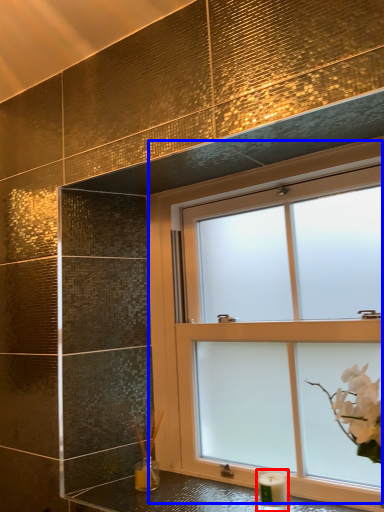
Question: Among these objects, which one is nearest to the camera, candle holder (highlighted by a red box) or window (highlighted by a blue box)?

Choices:
 (A) candle holder
 (B) window

Answer: (B)